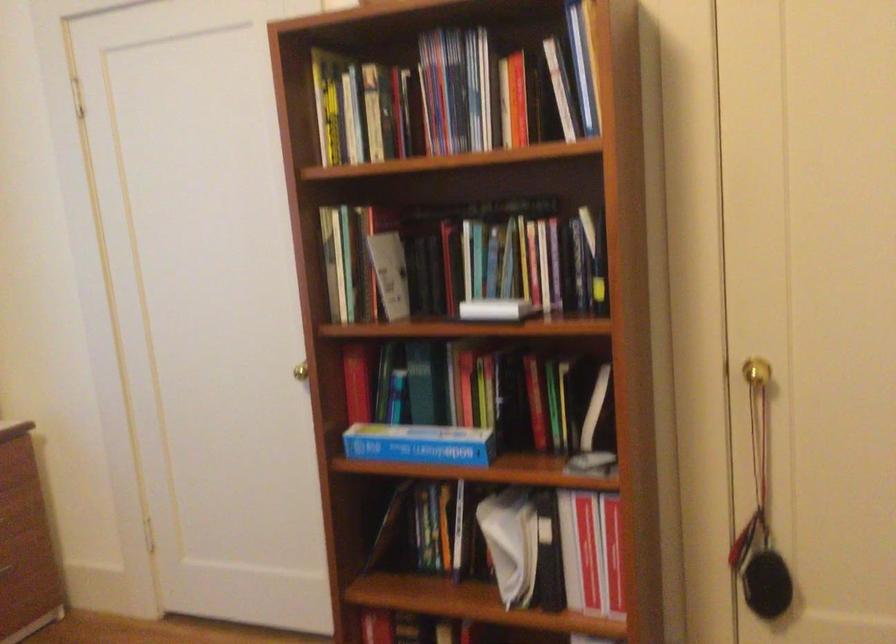
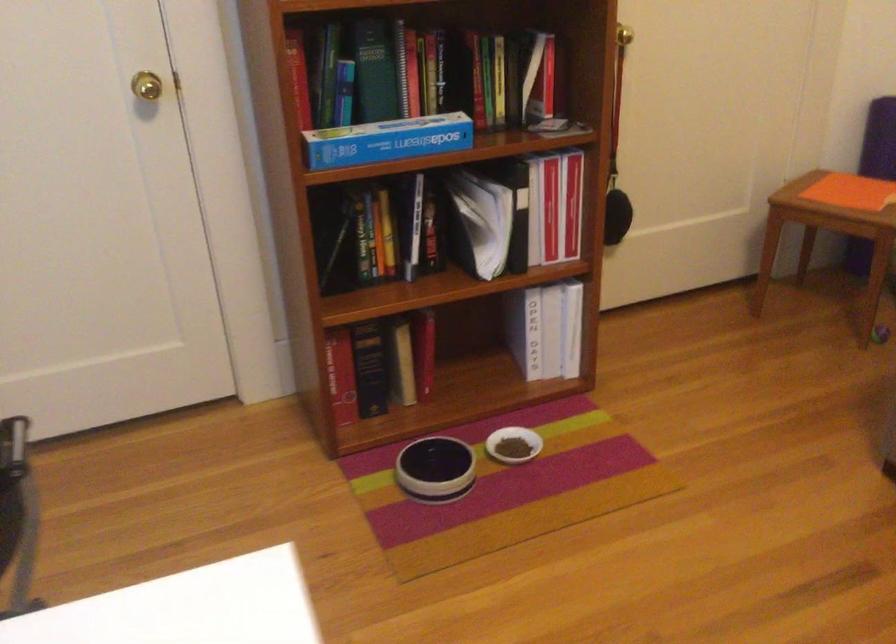
The point at [402,446] is marked in the first image. Where is the corresponding point in the second image?

(386, 140)